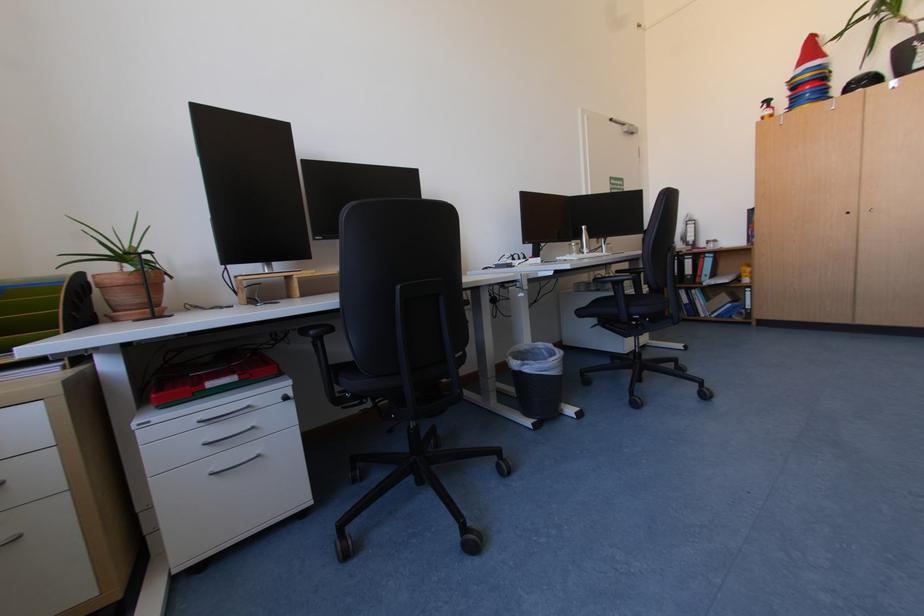
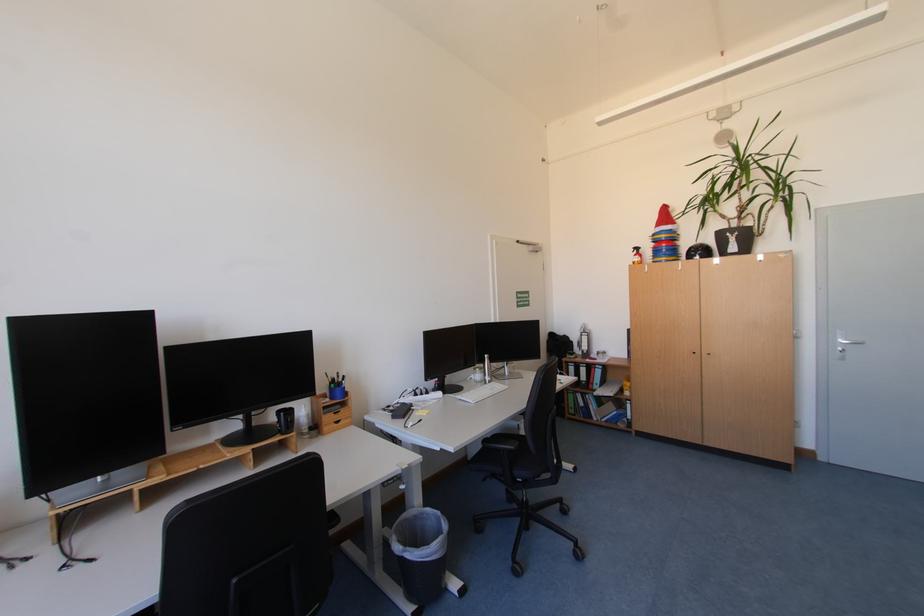
The point at (816, 95) is marked in the first image. Where is the corresponding point in the second image?

(672, 252)